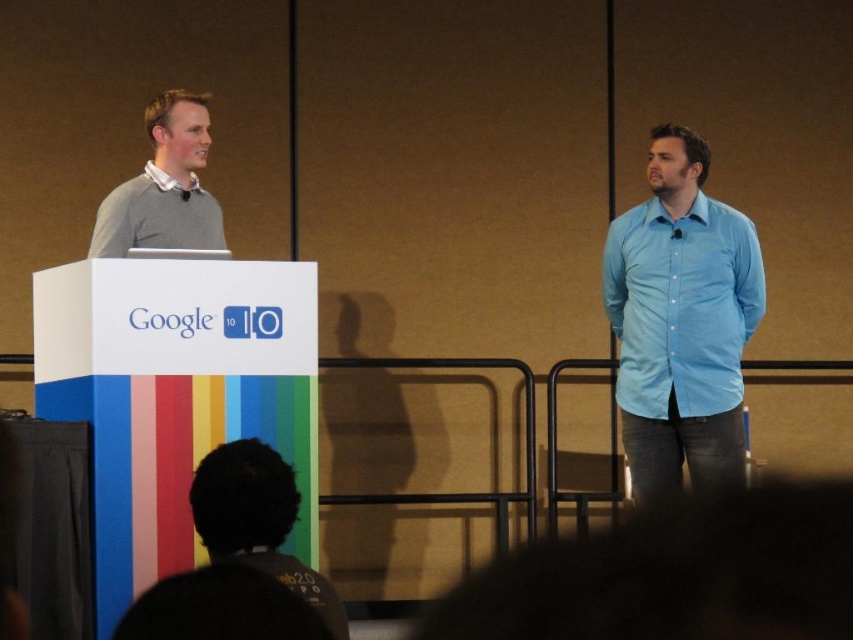
Can you confirm if light blue cotton shirt at right is smaller than dark hair at lower center?

Actually, light blue cotton shirt at right might be larger than dark hair at lower center.

Is light blue cotton shirt at right wider than dark hair at lower center?

Yes.

The width and height of the screenshot is (853, 640). What do you see at coordinates (682, 305) in the screenshot?
I see `light blue cotton shirt at right` at bounding box center [682, 305].

Find the location of a particular element. This screenshot has width=853, height=640. light blue cotton shirt at right is located at coordinates (682, 305).

Is point (717, 330) farther from camera compared to point (163, 113)?

Yes, point (717, 330) is farther from viewer.

Image resolution: width=853 pixels, height=640 pixels. Find the location of `light blue cotton shirt at right`. light blue cotton shirt at right is located at coordinates (682, 305).

Where is `light blue cotton shirt at right`? Image resolution: width=853 pixels, height=640 pixels. light blue cotton shirt at right is located at coordinates (682, 305).

Which of these two, dark hair at lower center or matte gray sweater at left, stands shorter?

dark hair at lower center is shorter.

The image size is (853, 640). Describe the element at coordinates (257, 518) in the screenshot. I see `dark hair at lower center` at that location.

The width and height of the screenshot is (853, 640). I want to click on dark hair at lower center, so click(257, 518).